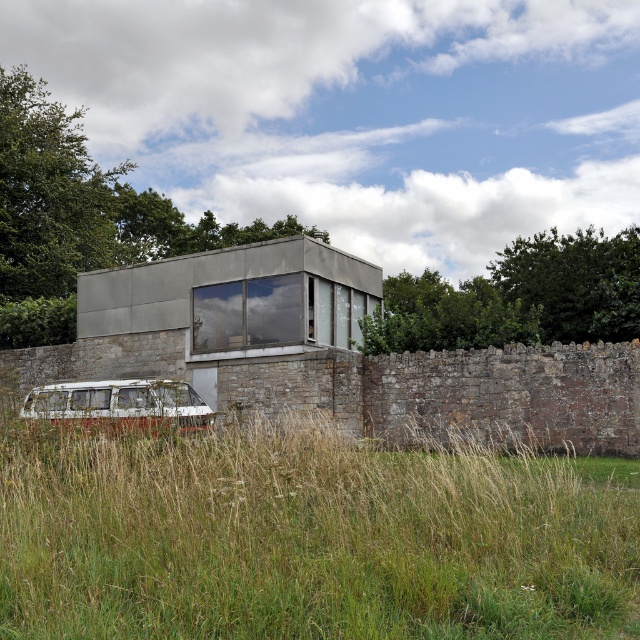
You are standing in front of the house and see the green grass at lower left and the white matte van at lower left. Which object is closer to the front of the scene?

The green grass at lower left is positioned under the white matte van at lower left, so the van is closer to the front of the scene than the grass.

You are standing at the entrance of the house and notice both the green grass at lower left and the white matte van at lower left. Which object is positioned more to the left side of the scene?

The white matte van at lower left is positioned more to the left side of the scene because the green grass at lower left is to the right of it.